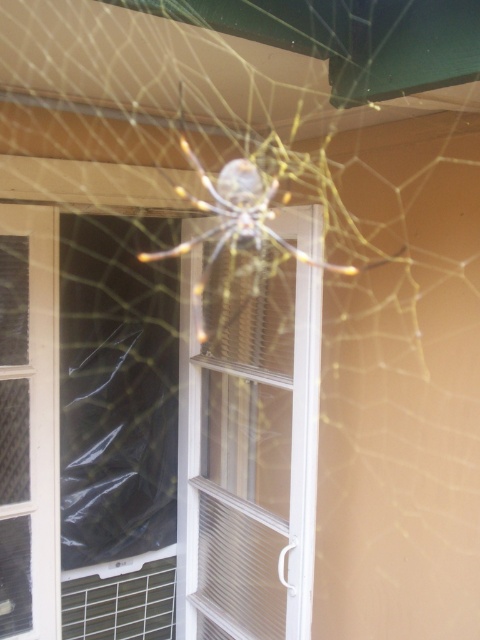
Question: Among these points, which one is farthest from the camera?

Choices:
 (A) (48, 528)
 (B) (252, 572)
 (C) (215, 234)

Answer: (C)

Question: Which object appears closest to the camera in this image?

Choices:
 (A) clear plastic screen door at left
 (B) clear plastic screen door at center
 (C) translucent yellow spider at center

Answer: (C)

Question: Which object is closer to the camera taking this photo?

Choices:
 (A) clear plastic screen door at center
 (B) clear plastic screen door at left
 (C) translucent yellow spider at center

Answer: (C)

Question: Can you confirm if clear plastic screen door at center is positioned to the right of translucent yellow spider at center?

Choices:
 (A) yes
 (B) no

Answer: (A)

Question: Does clear plastic screen door at center appear under translucent yellow spider at center?

Choices:
 (A) no
 (B) yes

Answer: (B)

Question: Does clear plastic screen door at center appear on the left side of translucent yellow spider at center?

Choices:
 (A) no
 (B) yes

Answer: (A)